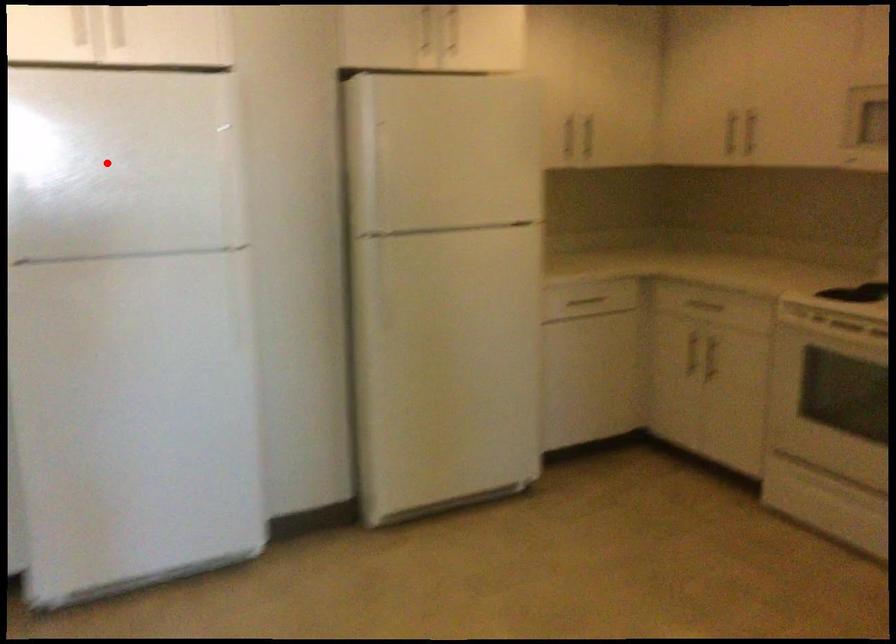
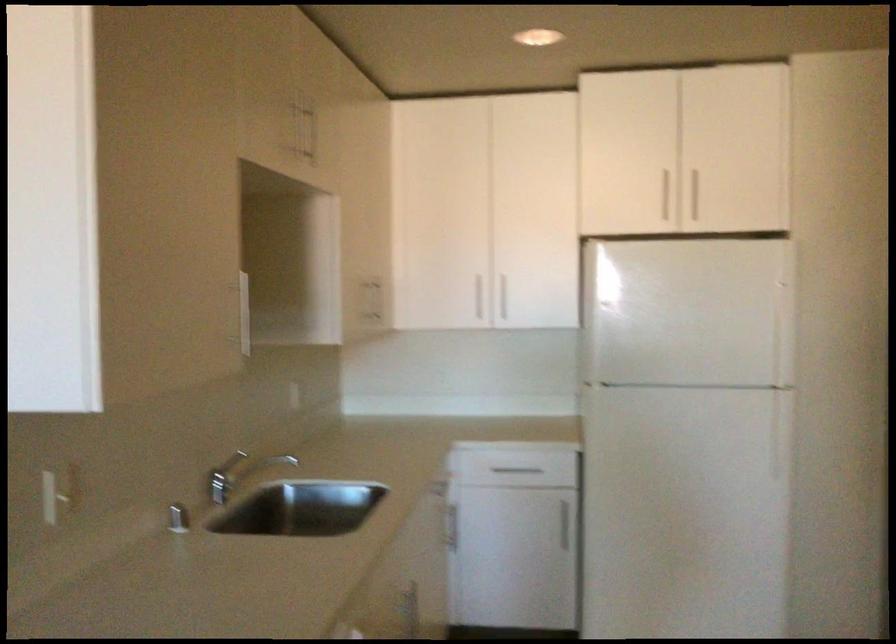
Where in the second image is the point corresponding to the highlighted location from the first image?

(687, 313)